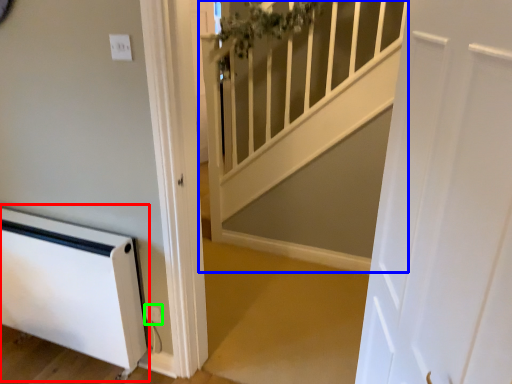
Question: Considering the real-world distances, which object is closest to appliance (highlighted by a red box)? stairwell (highlighted by a blue box) or electric outlet (highlighted by a green box).

Choices:
 (A) stairwell
 (B) electric outlet

Answer: (B)